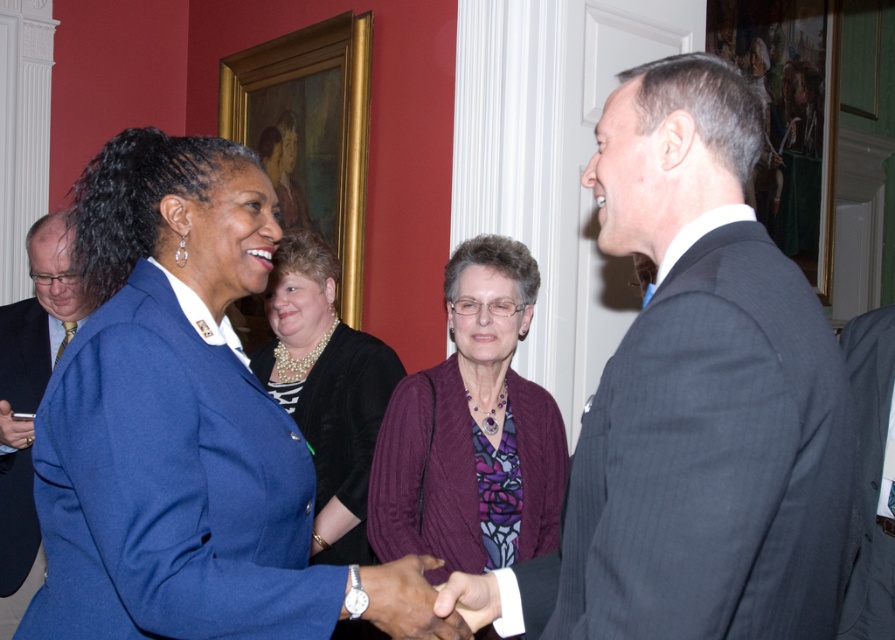
You are standing at the point with coordinates (708, 464) in the image. What object is located at this point?

The point at (708, 464) corresponds to the dark gray pinstripe suit at right.

Based on the photo, you are organizing a charity event and need to decide which clothing item to display first. Based on their sizes, which one should you choose between the matte blue blazer at left and the purple ribbed sweater at center?

The purple ribbed sweater at center is larger than the matte blue blazer at left, so you should display the purple ribbed sweater at center first to make a bigger visual impact.

You are standing at the point with coordinates (326,388) in the image. What object is located exactly at this point?

The pearl necklace at center is located exactly at point (326,388).